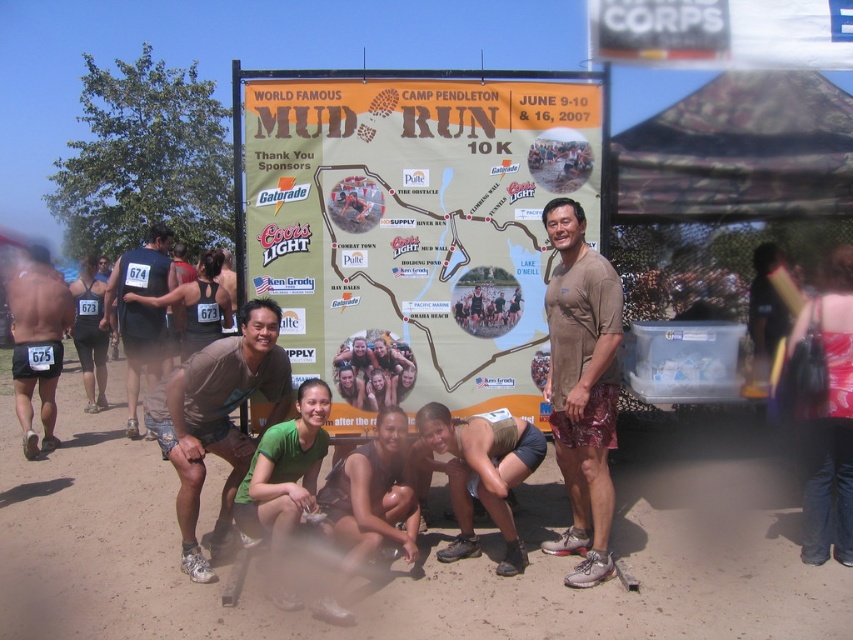
Based on the photo, is green fabric shirt at center to the left of matte black shorts at left from the viewer's perspective?

Incorrect, green fabric shirt at center is not on the left side of matte black shorts at left.

Which is above, green fabric shirt at center or matte black shorts at left?

Positioned higher is green fabric shirt at center.

Between point (300, 400) and point (48, 442), which one is positioned behind?

The point (48, 442) is more distant.

Where is `green fabric shirt at center`? green fabric shirt at center is located at coordinates (283, 481).

Based on the photo, does brown sandy dirt at center appear over denim pants at lower right?

Actually, brown sandy dirt at center is below denim pants at lower right.

Does brown sandy dirt at center appear under denim pants at lower right?

Indeed, brown sandy dirt at center is positioned under denim pants at lower right.

Where is `brown sandy dirt at center`? brown sandy dirt at center is located at coordinates pos(401,563).

Who is more distant from viewer, (843, 460) or (381, 516)?

The point (843, 460) is more distant.

Between point (817, 483) and point (405, 472), which one is positioned in front?

Positioned in front is point (817, 483).

Where is `denim pants at lower right`? This screenshot has height=640, width=853. denim pants at lower right is located at coordinates (828, 417).